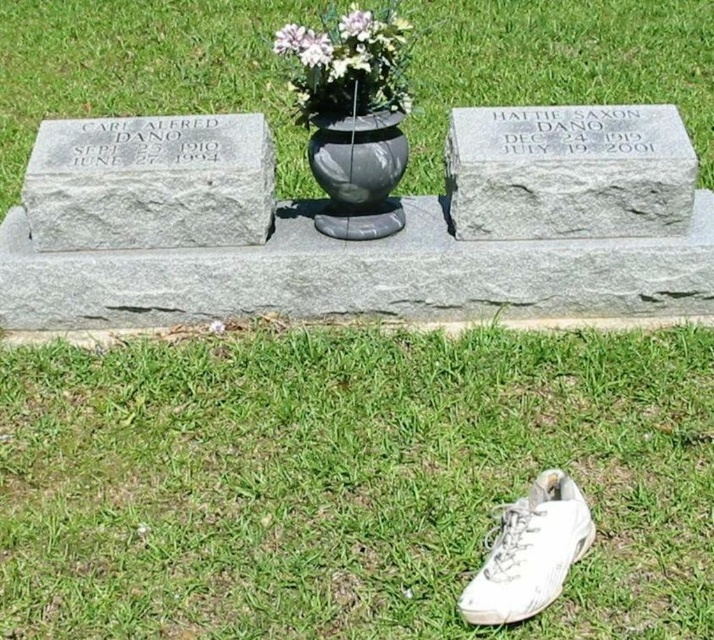
You are a groundskeeper in the cemetery and need to place a white leather shoe at lower right and a white matte vase at center for a memorial. The path between them is 6.21 feet wide. If your lawnmower is 2.5 feet wide, can you safely mow between them without hitting either?

The white leather shoe at lower right and white matte vase at center are 6.21 feet apart. Since the lawnmower is 2.5 feet wide, there is enough space between them to safely mow without hitting either object.

You are standing in the cemetery and want to place a white leather shoe at lower right at the base of the gravestone for HATTIE SAXON DANO. Considering the distance between the two gravestones, will the shoe be closer to CARL ALFRED DANO or HATTIE SAXON DANO?

The white leather shoe at lower right is placed at the base of HATTIE SAXON DANO, so it will be closer to HATTIE SAXON DANO than CARL ALFRED DANO, as the gravestones are 6.86 feet apart.